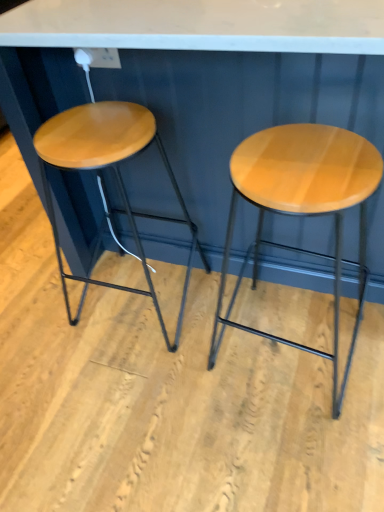
Question: From a real-world perspective, is matte wood stool at center, acting as the second stool starting from the left, above or below matte wood stool at left, positioned as the 2th stool in right-to-left order?

Choices:
 (A) above
 (B) below

Answer: (B)

Question: Is matte wood stool at center, acting as the second stool starting from the left, bigger or smaller than matte wood stool at left, positioned as the 2th stool in right-to-left order?

Choices:
 (A) small
 (B) big

Answer: (B)

Question: Is matte wood stool at center, the first stool positioned from the right, wider or thinner than matte wood stool at left, the 1th stool viewed from the left?

Choices:
 (A) thin
 (B) wide

Answer: (B)

Question: From the image's perspective, is matte wood stool at left, the 1th stool viewed from the left, positioned above or below matte wood stool at center, acting as the second stool starting from the left?

Choices:
 (A) above
 (B) below

Answer: (A)

Question: From a real-world perspective, is matte wood stool at left, the 1th stool viewed from the left, physically located above or below matte wood stool at center, the first stool positioned from the right?

Choices:
 (A) above
 (B) below

Answer: (A)

Question: Does point (142, 265) appear closer or farther from the camera than point (279, 158)?

Choices:
 (A) closer
 (B) farther

Answer: (B)

Question: In terms of size, does matte wood stool at left, positioned as the 2th stool in right-to-left order, appear bigger or smaller than matte wood stool at center, acting as the second stool starting from the left?

Choices:
 (A) big
 (B) small

Answer: (B)